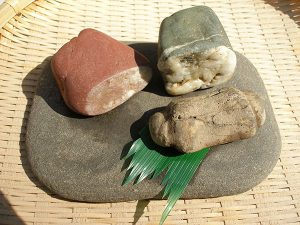
The height and width of the screenshot is (225, 300). In order to click on brown wicker in this screenshot , I will do `click(38, 29)`.